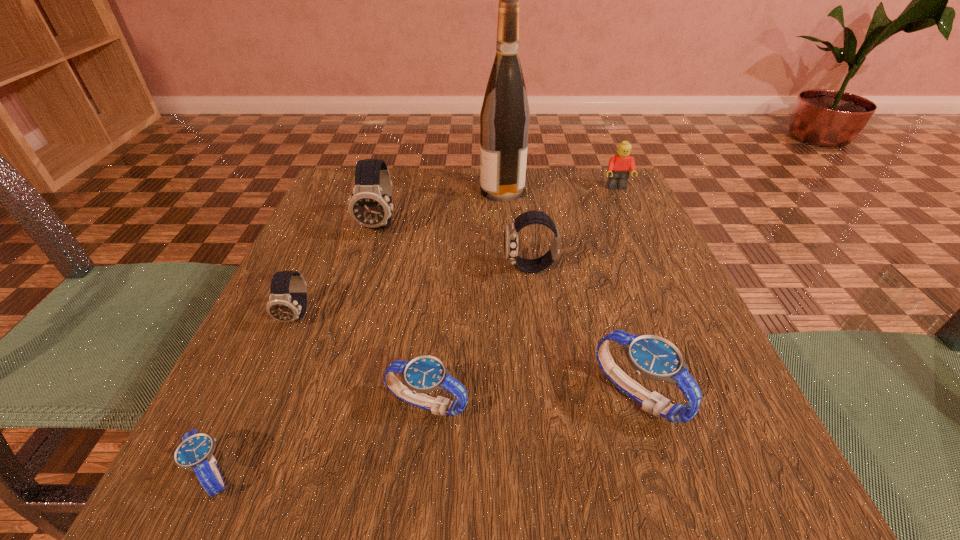
Where is `vacant space that satisfies the following two spatial constraints: 1. on the face of the biggest blue watch; 2. on the left side of the fourth nearest object`? vacant space that satisfies the following two spatial constraints: 1. on the face of the biggest blue watch; 2. on the left side of the fourth nearest object is located at coordinates (263, 395).

Where is `vacant space that satisfies the following two spatial constraints: 1. on the face of the rightmost dark watch; 2. on the face of the leftmost dark watch`? This screenshot has width=960, height=540. vacant space that satisfies the following two spatial constraints: 1. on the face of the rightmost dark watch; 2. on the face of the leftmost dark watch is located at coordinates (536, 315).